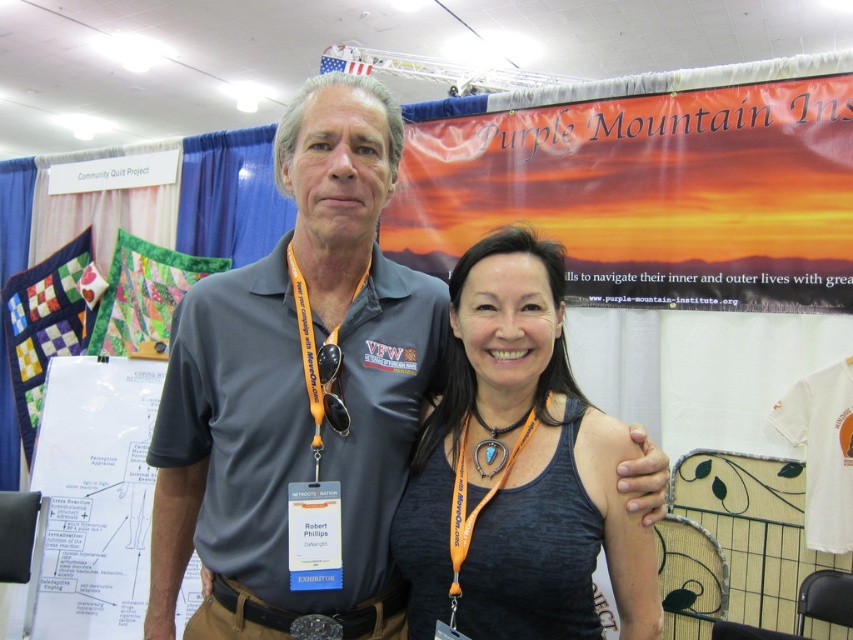
You are a delivery person who needs to hand a package to Robert Phillips. You are currently standing at the point marked by the coordinate point at point (230, 465). Which direction should you move to reach Robert Phillips?

Since the point at (230, 465) is where the woman is standing and they are 1.16 meters apart, you should move towards Robert Phillips who is 1.16 meters away from the woman.